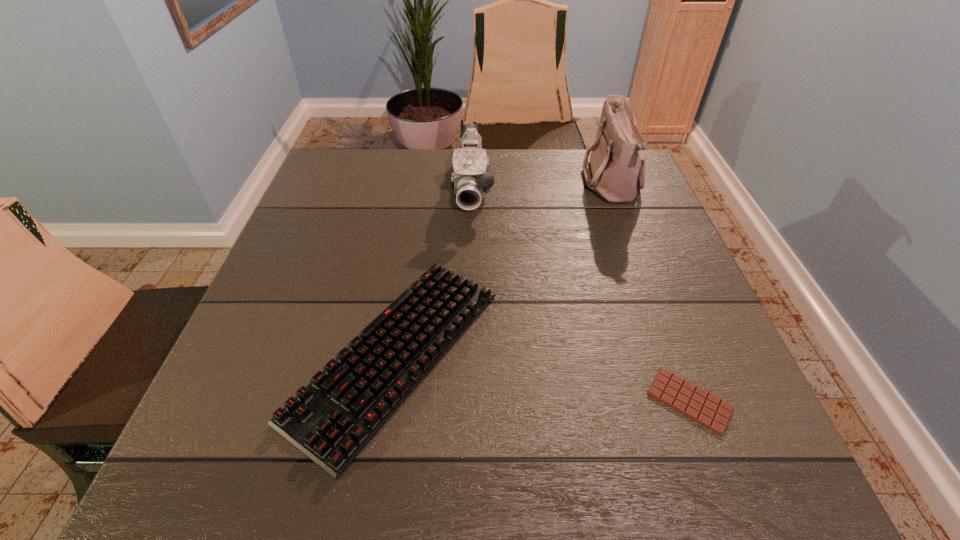
I want to click on shoulder bag, so click(x=616, y=171).

At what (x,y) coordinates should I click in order to perform the action: click on camcorder. Please return your answer as a coordinate pair (x, y). Looking at the image, I should click on (470, 178).

Where is `the third tallest object`? The width and height of the screenshot is (960, 540). the third tallest object is located at coordinates (331, 420).

Where is `the shortest object`? This screenshot has height=540, width=960. the shortest object is located at coordinates (694, 402).

This screenshot has height=540, width=960. I want to click on vacant space located 0.340m on the front pocket of the shoulder bag, so click(x=455, y=184).

At what (x,y) coordinates should I click in order to perform the action: click on free point located 0.060m on the front pocket of the shoulder bag. Please return your answer as a coordinate pair (x, y). The width and height of the screenshot is (960, 540). Looking at the image, I should click on (561, 184).

The height and width of the screenshot is (540, 960). Find the location of `free spot located 0.110m on the front pocket of the shoulder bag`. free spot located 0.110m on the front pocket of the shoulder bag is located at coordinates (542, 184).

Locate an element on the screen. free space located 0.150m on the front-facing side of the camcorder is located at coordinates (470, 259).

Where is `blank area located 0.130m on the right of the third tallest object`? The width and height of the screenshot is (960, 540). blank area located 0.130m on the right of the third tallest object is located at coordinates (570, 354).

Where is `vacant space located 0.200m on the back of the shortest object`? This screenshot has height=540, width=960. vacant space located 0.200m on the back of the shortest object is located at coordinates (647, 286).